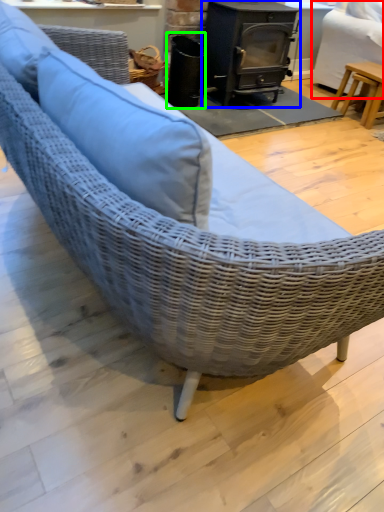
Question: Which object is positioned farthest from swivel chair (highlighted by a red box)? Select from wood burning stove (highlighted by a blue box) and appliance (highlighted by a green box).

Choices:
 (A) wood burning stove
 (B) appliance

Answer: (B)